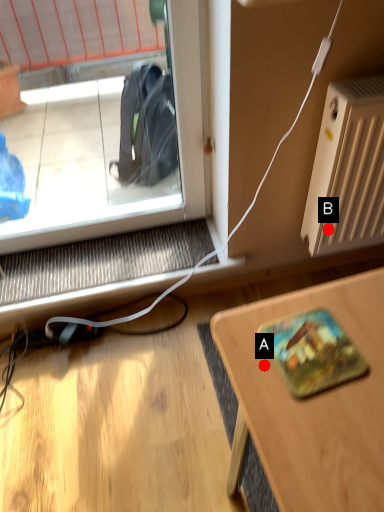
Question: Two points are circled on the image, labeled by A and B beside each circle. Which point is further to the camera?

Choices:
 (A) A is further
 (B) B is further

Answer: (B)